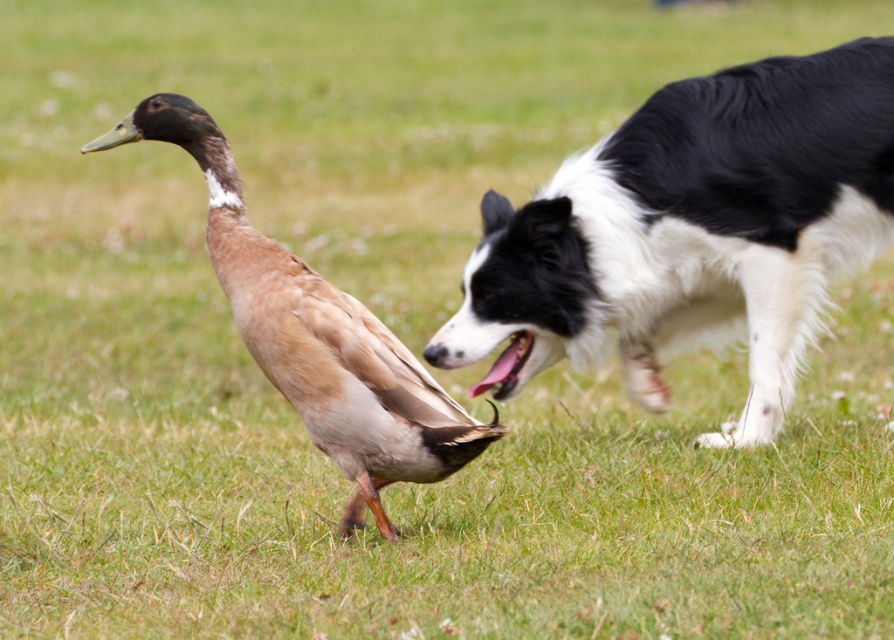
Is black and white fur dog at right smaller than brown feathered duck at center?

No.

Can you confirm if black and white fur dog at right is positioned below brown feathered duck at center?

No.

Who is more distant from viewer, (x=628, y=296) or (x=273, y=310)?

Point (x=628, y=296)

At what (x,y) coordinates should I click in order to perform the action: click on black and white fur dog at right. Please return your answer as a coordinate pair (x, y). The image size is (894, 640). Looking at the image, I should click on (692, 232).